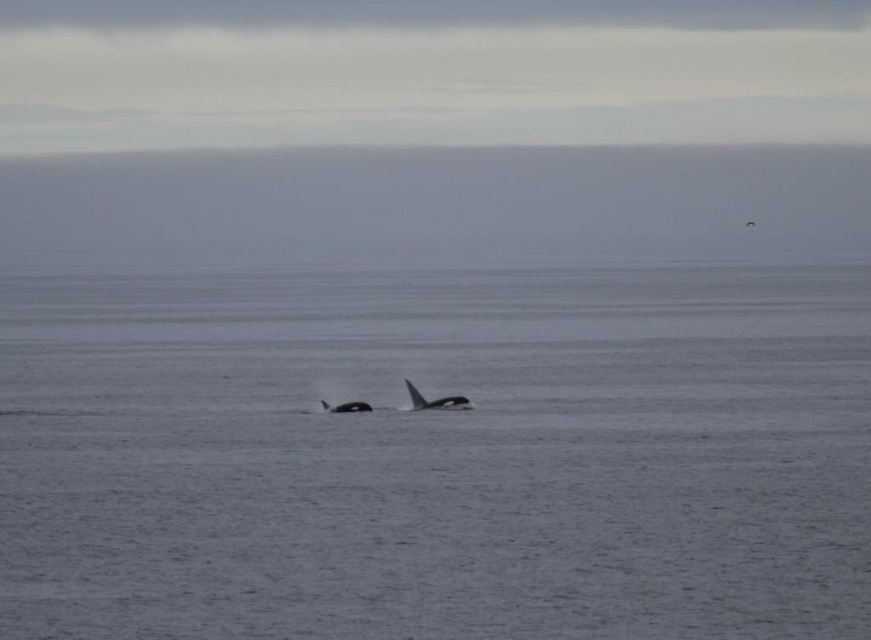
Is black matte whale at center below black smooth whale at center?

No, black matte whale at center is not below black smooth whale at center.

Is black matte whale at center to the right of black smooth whale at center from the viewer's perspective?

Correct, you'll find black matte whale at center to the right of black smooth whale at center.

Which is in front, point (409, 392) or point (321, 403)?

Point (409, 392)

This screenshot has width=871, height=640. In order to click on black matte whale at center in this screenshot , I will do `click(434, 401)`.

Consider the image. Does gray water at center have a lesser width compared to black smooth whale at center?

No, gray water at center is not thinner than black smooth whale at center.

What do you see at coordinates (437, 454) in the screenshot?
I see `gray water at center` at bounding box center [437, 454].

Which is behind, point (230, 522) or point (359, 410)?

The point (359, 410) is behind.

Identify the location of gray water at center. (437, 454).

Is gray water at center positioned before black matte whale at center?

Yes, gray water at center is closer to the viewer.

Which is below, gray water at center or black matte whale at center?

black matte whale at center

Which is in front, point (422, 369) or point (451, 401)?

Point (451, 401) is in front.

Where is `gray water at center`? gray water at center is located at coordinates (437, 454).